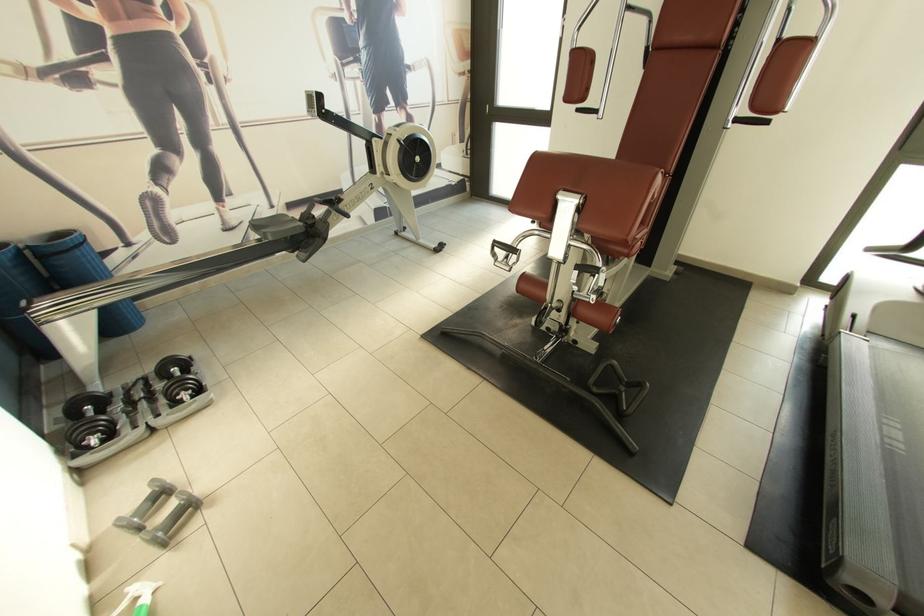
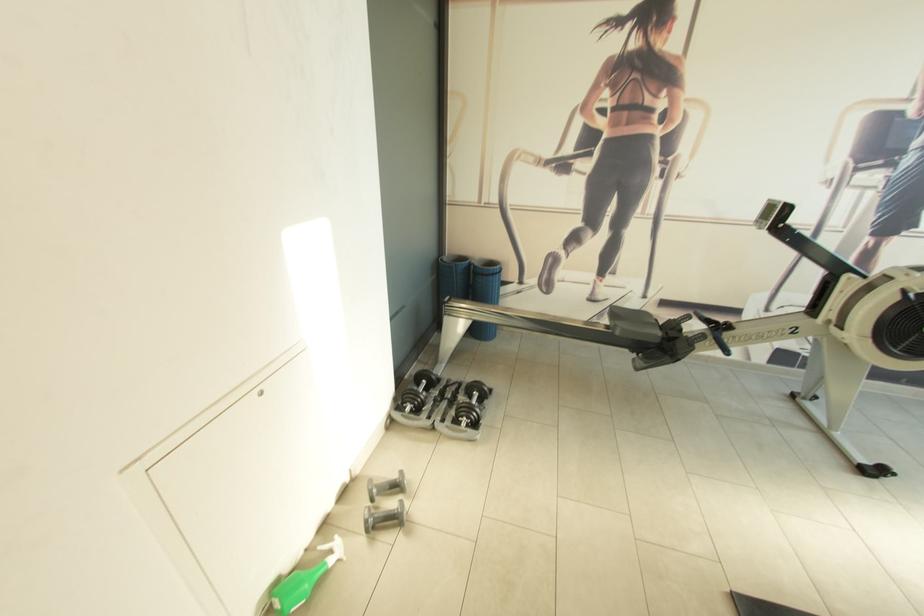
The point at [325,99] is marked in the first image. Where is the corresponding point in the second image?

(792, 209)